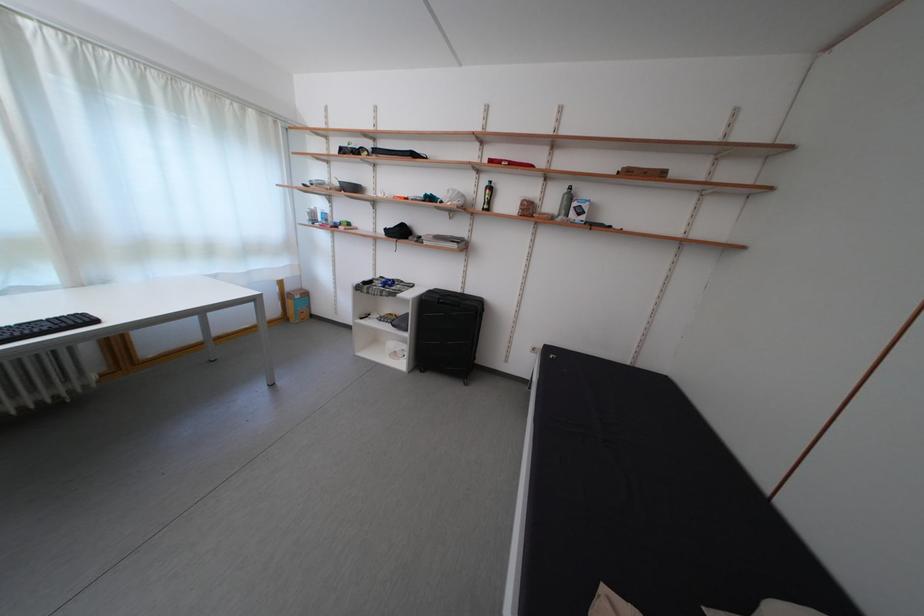
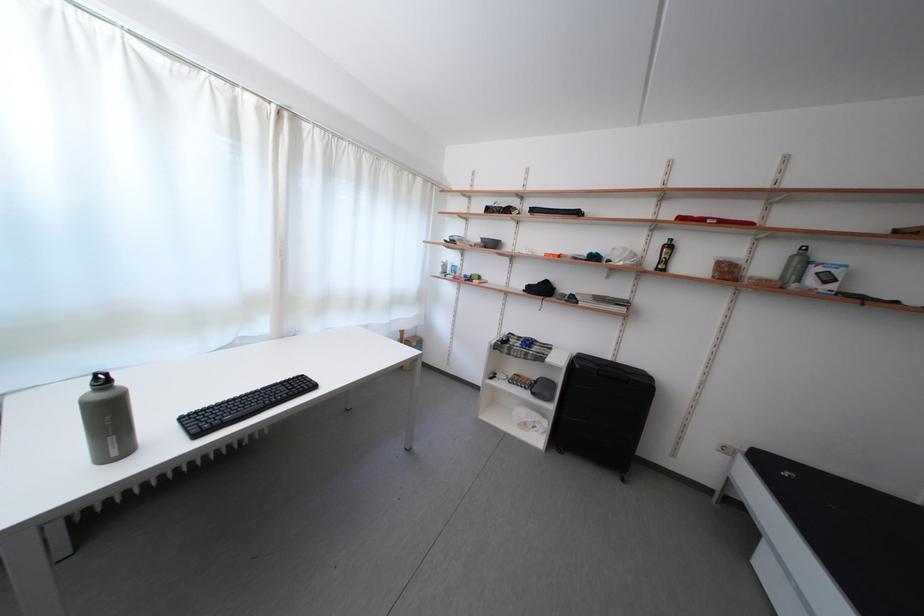
Locate, in the second image, the point that corresponds to (493,188) in the first image.

(669, 246)